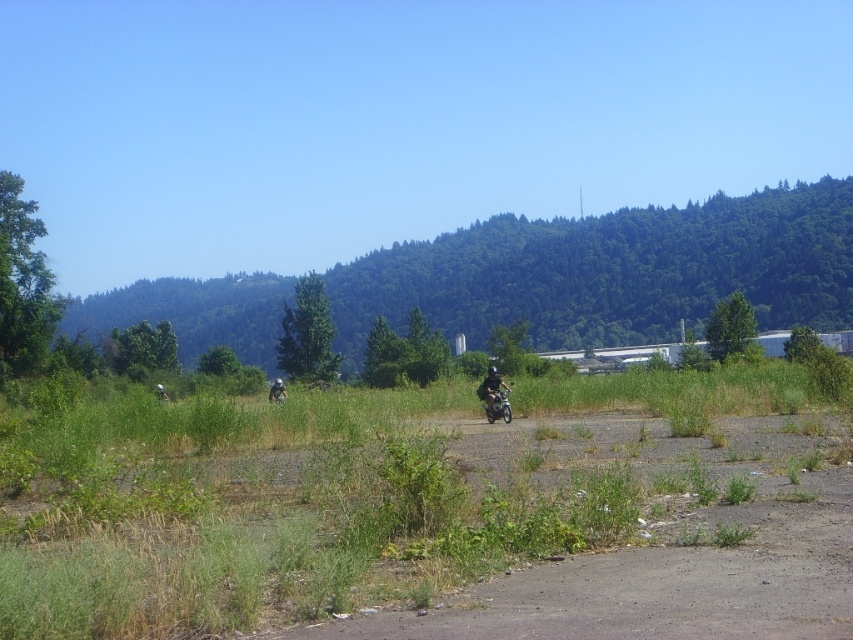
You are standing at the starting point of the paved path and want to reach the gravelly brown dirt field at center. Which direction should you head towards?

The gravelly brown dirt field at center is located at point (491, 547), so you should head towards the center of the image to reach it.

You are a drone operator tasked with capturing aerial footage of the two cyclists. The metallic silver helmet at center and the light gray helmeted person at center are your main subjects. Your drone has a maximum effective range of 10 meters. Can your drone capture both subjects simultaneously without exceeding its range?

The distance between the metallic silver helmet at center and the light gray helmeted person at center is 10.93 meters, which exceeds the drone operator maximum effective range of 10 meters. Therefore, the drone cannot capture both subjects simultaneously without exceeding its range.

You are standing at the point marked as point (x=491, y=547) in the image. Looking towards the forested hillside in the background, which direction should you walk to reach the paved path where the two cyclists are riding?

To reach the paved path where the two cyclists are riding from point (x=491, y=547), you should walk towards the direction of the cyclists along the path. Since the path is in the middle ground and the point is on the gravelly brown dirt field at center, moving towards the middle ground area where the path exists will lead you to the cyclists.